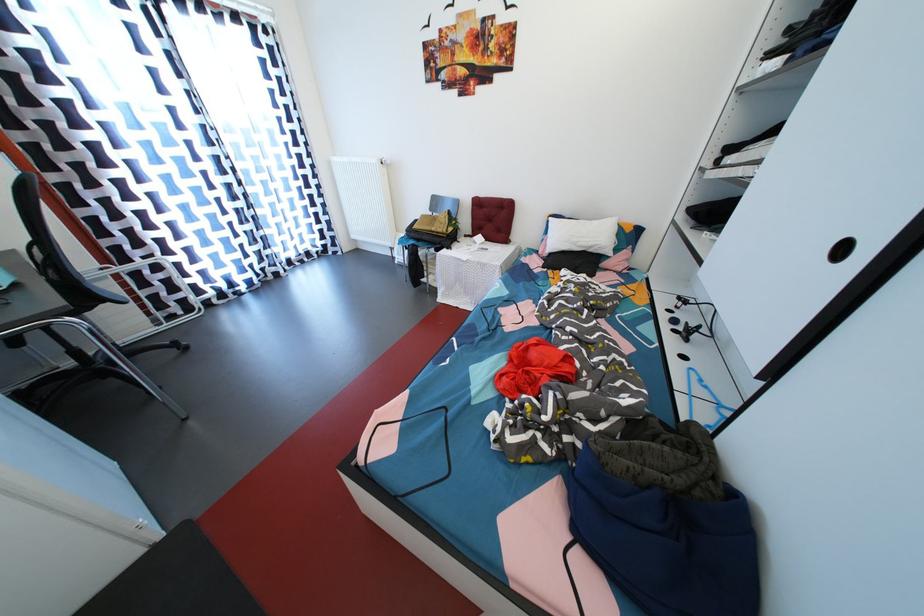
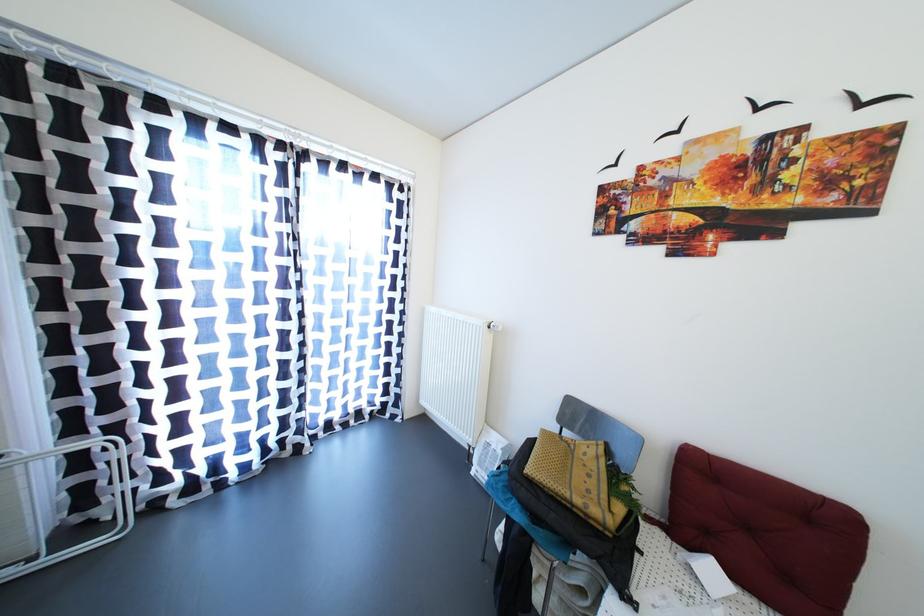
In the second image, find the point that corresponds to pixel 166 330 in the first image.

(39, 564)